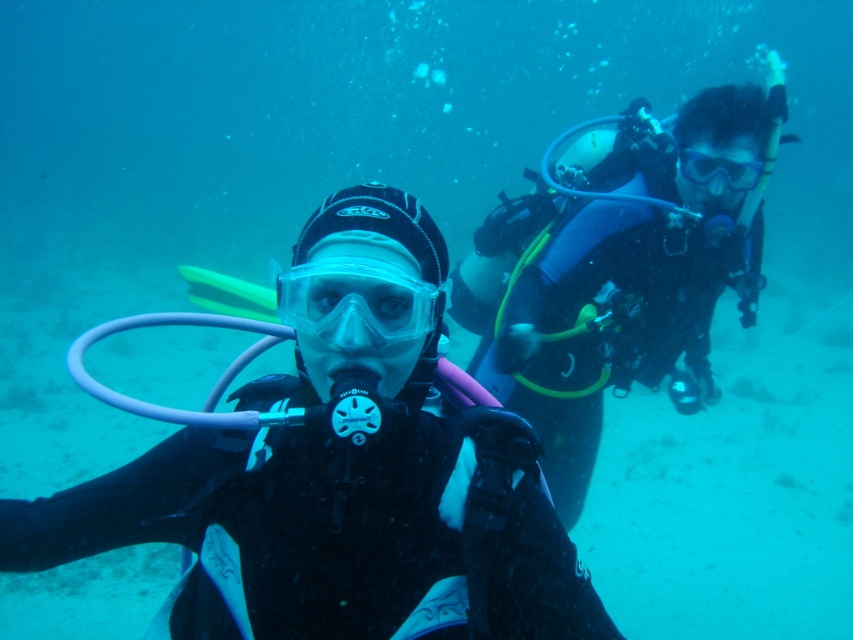
Question: Is black matte wetsuit at center behind transparent plastic goggles at center?

Choices:
 (A) yes
 (B) no

Answer: (B)

Question: Which object is the farthest from the transparent plastic goggles at center?

Choices:
 (A) black matte scuba diver at right
 (B) clear plastic goggles at center
 (C) black matte wetsuit at center

Answer: (A)

Question: Does black matte scuba diver at right have a greater width compared to transparent plastic goggles at center?

Choices:
 (A) yes
 (B) no

Answer: (A)

Question: Which object appears closest to the camera in this image?

Choices:
 (A) clear plastic goggles at center
 (B) black matte scuba diver at right

Answer: (B)

Question: Among these objects, which one is farthest from the camera?

Choices:
 (A) clear plastic goggles at center
 (B) black matte wetsuit at center
 (C) black matte scuba diver at right

Answer: (A)

Question: Can you confirm if black matte wetsuit at center is positioned above black matte scuba diver at right?

Choices:
 (A) no
 (B) yes

Answer: (A)